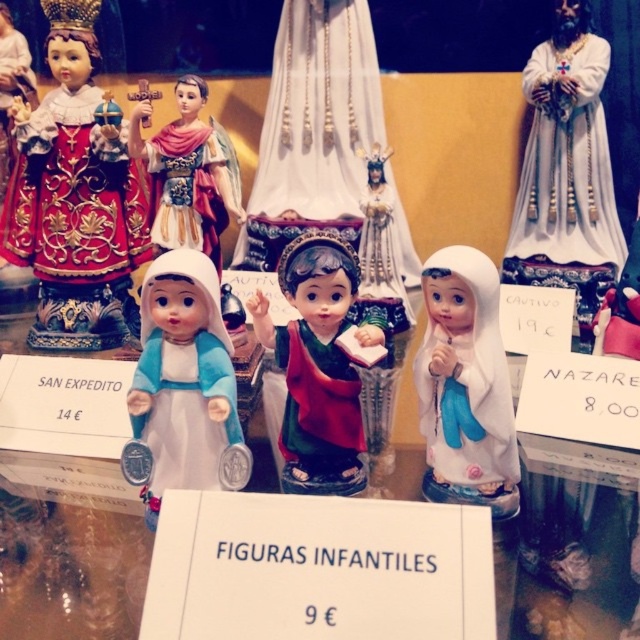
You are a customer in a figurine shop and want to place a gift card between the white glossy statue at upper right and the matte red fabric doll at center. Based on their positions, where should you place the gift card?

The white glossy statue at upper right is to the right of the matte red fabric doll at center, so you should place the gift card to the right side of the matte red fabric doll at center, between them.

You are a customer in a shop looking at the figurines. You want to place a small gift on the shelf between the white glossy statue at upper right and the matte red fabric doll at center. Is there enough space for the gift?

The white glossy statue at upper right is positioned over the matte red fabric doll at center, meaning there is no space between them for placing a gift.